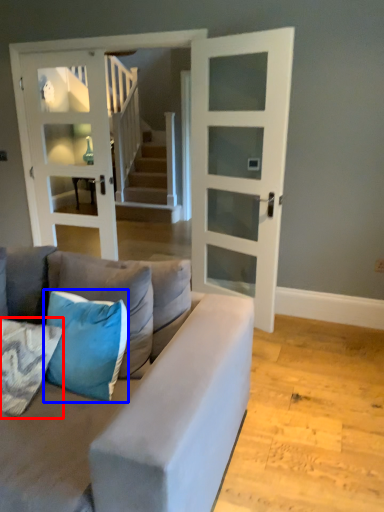
Question: Which point is closer to the camera, pillow (highlighted by a red box) or pillow (highlighted by a blue box)?

Choices:
 (A) pillow
 (B) pillow

Answer: (A)